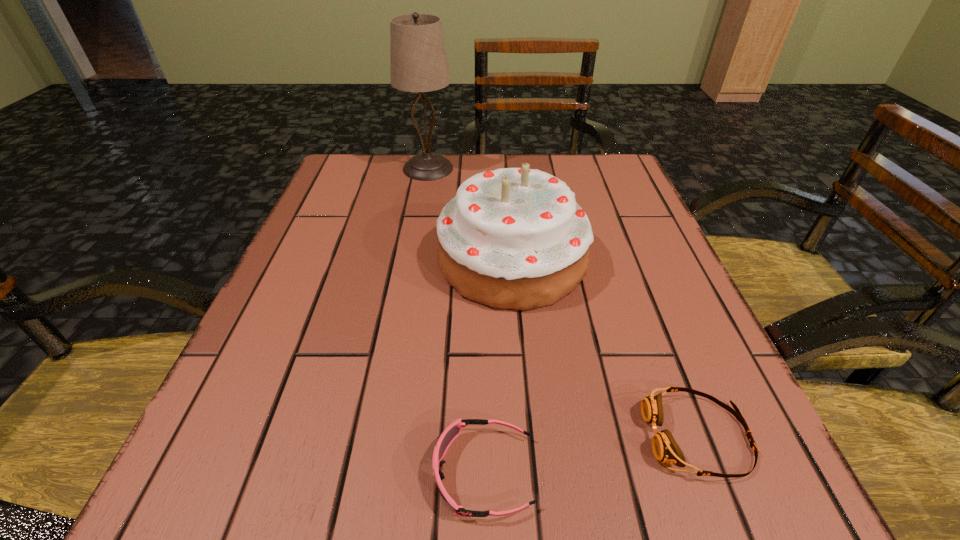
Image resolution: width=960 pixels, height=540 pixels. I want to click on the farthest object, so click(418, 62).

Find the location of a particular element. The height and width of the screenshot is (540, 960). lampshade is located at coordinates (418, 62).

Identify the location of the third shortest object. (513, 238).

Find the location of a particular element. the third nearest object is located at coordinates (513, 238).

Find the location of a particular element. The height and width of the screenshot is (540, 960). the right goggles is located at coordinates (665, 448).

Find the location of a particular element. The height and width of the screenshot is (540, 960). the left goggles is located at coordinates (452, 431).

At what (x,y) coordinates should I click in order to perform the action: click on vacant space located 0.060m on the front-facing side of the lampshade. Please return your answer as a coordinate pair (x, y). This screenshot has width=960, height=540. Looking at the image, I should click on (478, 168).

This screenshot has width=960, height=540. In order to click on vacant space located on the right of the cake in this screenshot , I will do `click(632, 260)`.

Locate an element on the screen. Image resolution: width=960 pixels, height=540 pixels. vacant space situated 0.180m with the lenses facing forward on the right goggles is located at coordinates (512, 436).

In order to click on free region located 0.140m with the lenses facing forward on the right goggles in this screenshot , I will do `click(541, 436)`.